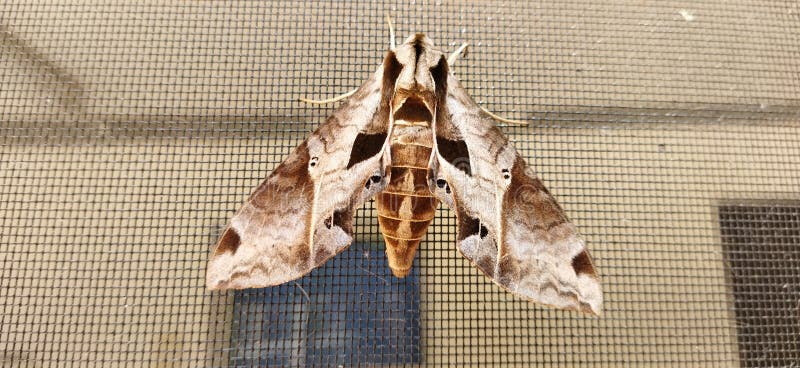
Image resolution: width=800 pixels, height=368 pixels. Find the location of `screen`. screen is located at coordinates (164, 238).